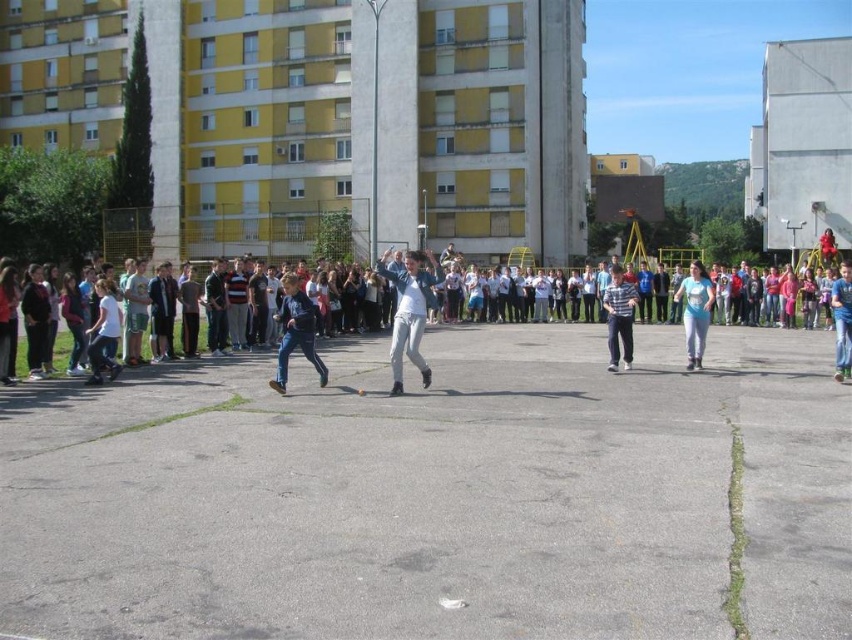
You are standing at the origin point of the coordinate system. You want to throw a ball to the light blue jeans at center. What are the coordinates you should aim for?

The coordinates you should aim for are 0.487 on the x axis and 0.218 on the y axis, which is the position of the light blue jeans at center.

You are a photographer standing at the edge of the paved area. You want to take a photo that includes both the light gray fabric pants at center and the light blue denim jeans at center. What is the minimum distance you need to move backward to ensure both are fully visible in your frame?

The light gray fabric pants at center and light blue denim jeans at center are 7.96 meters apart. To capture both in the same frame, you need to move back at least 7.96 meters to ensure the entire distance between them fits within your camera view.